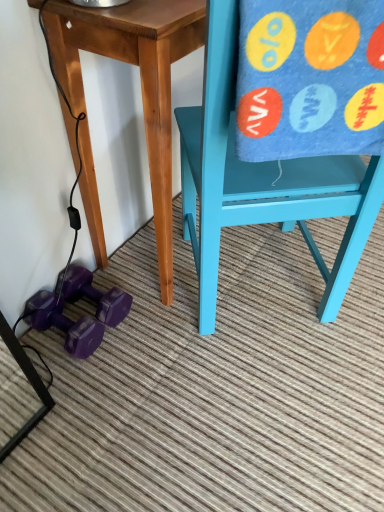
You are a GUI agent. You are given a task and a screenshot of the screen. Output one action in this format:
    pyautogui.click(x=<x>, y=<y>)
    Task: Click on the vacant area in front of purple rubber dumbbell at lower left, the second dumbbell in the top-to-bottom sequence
    
    Given the screenshot: What is the action you would take?
    pyautogui.click(x=65, y=394)